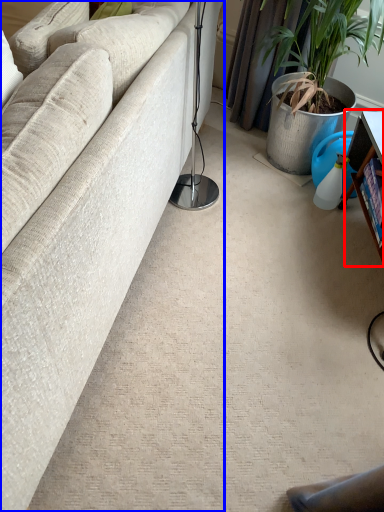
Question: Which object appears closest to the camera in this image, table (highlighted by a red box) or studio couch (highlighted by a blue box)?

Choices:
 (A) table
 (B) studio couch

Answer: (B)